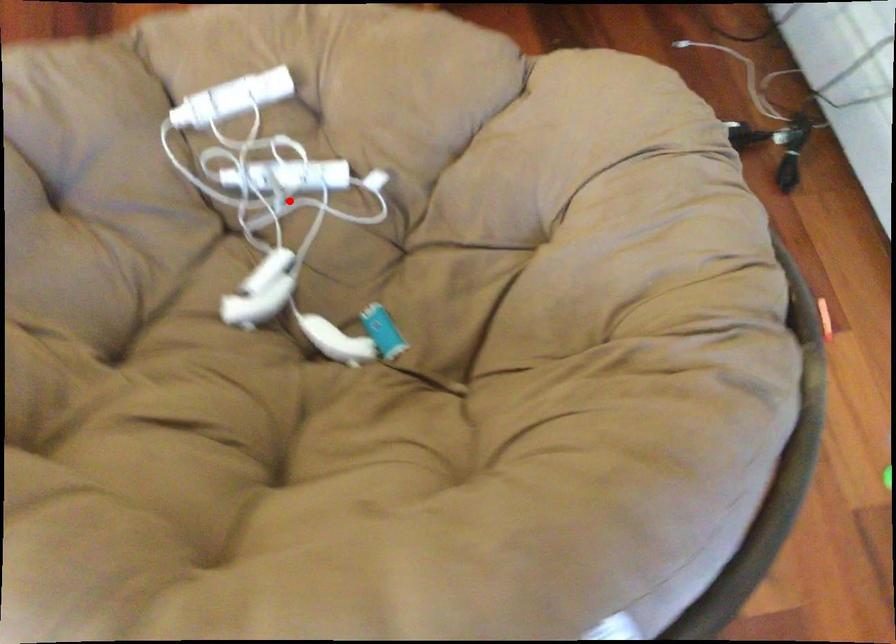
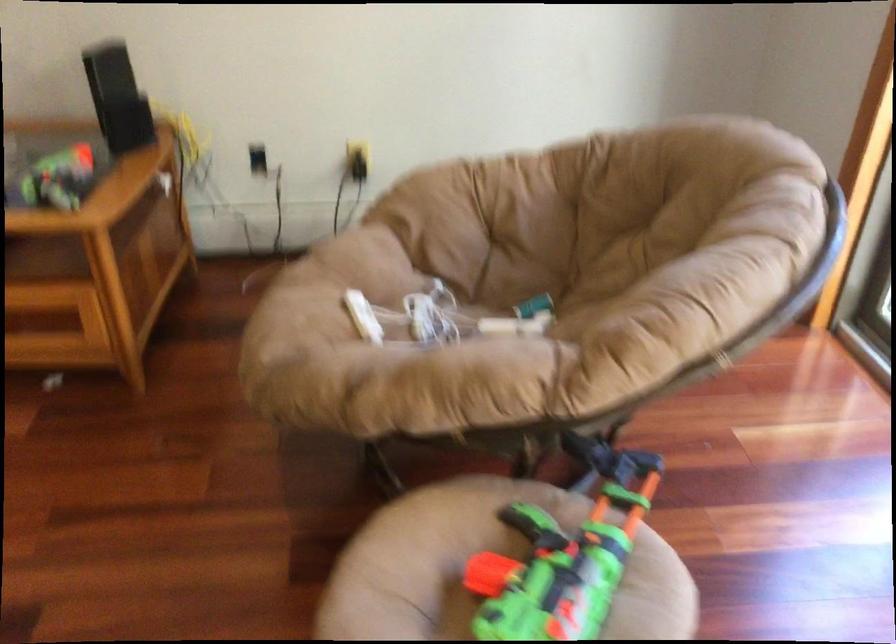
Question: I am providing you with two images of the same scene from different viewpoints. Given a red point in image1, look at the same physical point in image2. Is it:

Choices:
 (A) Closer to the viewpoint
 (B) Farther from the viewpoint

Answer: (B)